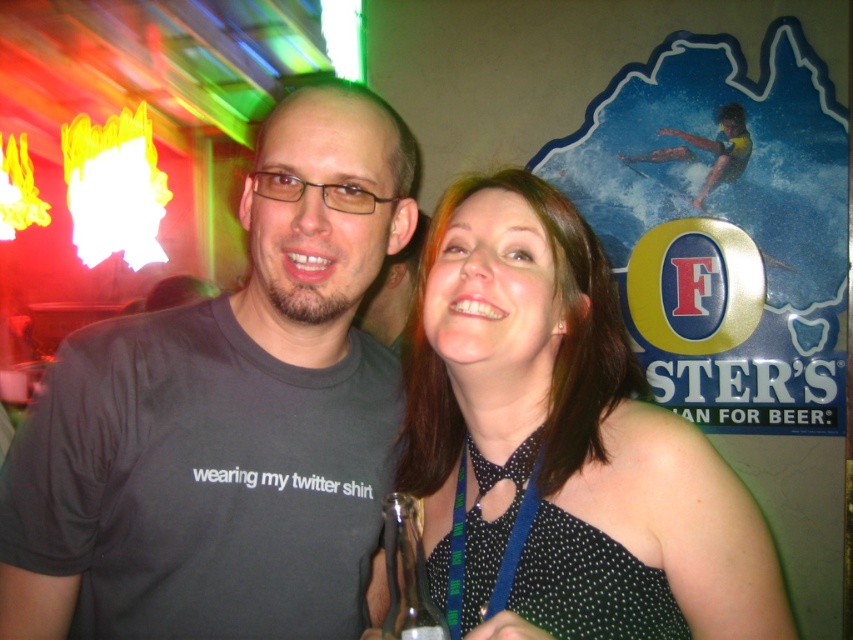
At what (x,y) coordinates should I click in order to perform the action: click on dark gray t-shirt at center. Please return your answer as a coordinate pair (x, y). Image resolution: width=853 pixels, height=640 pixels. Looking at the image, I should click on (228, 419).

Does dark gray t-shirt at center have a lesser width compared to black dotted dress at center?

No, dark gray t-shirt at center is not thinner than black dotted dress at center.

Does point (223, 442) come closer to viewer compared to point (543, 458)?

No, it is behind (543, 458).

At what (x,y) coordinates should I click in order to perform the action: click on dark gray t-shirt at center. Please return your answer as a coordinate pair (x, y). Looking at the image, I should click on (228, 419).

Is black dotted dress at center wider than clear glass bottle at center?

Correct, the width of black dotted dress at center exceeds that of clear glass bottle at center.

Between black dotted dress at center and clear glass bottle at center, which one has less height?

Standing shorter between the two is clear glass bottle at center.

Describe the element at coordinates (564, 440) in the screenshot. I see `black dotted dress at center` at that location.

Identify the location of black dotted dress at center. The height and width of the screenshot is (640, 853). (564, 440).

Does dark gray t-shirt at center appear over clear glass bottle at center?

Indeed, dark gray t-shirt at center is positioned over clear glass bottle at center.

This screenshot has width=853, height=640. Describe the element at coordinates (228, 419) in the screenshot. I see `dark gray t-shirt at center` at that location.

At what (x,y) coordinates should I click in order to perform the action: click on dark gray t-shirt at center. Please return your answer as a coordinate pair (x, y). Looking at the image, I should click on (228, 419).

The image size is (853, 640). Identify the location of dark gray t-shirt at center. (228, 419).